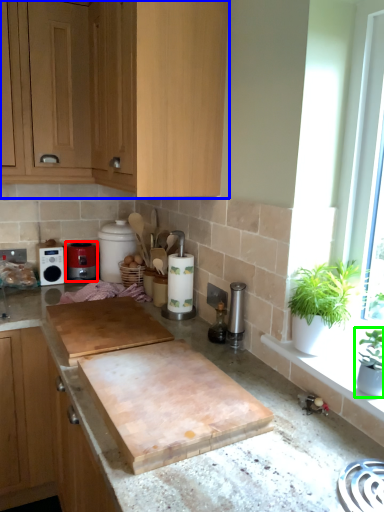
Question: Considering the real-world distances, which object is farthest from kitchen appliance (highlighted by a red box)? cabinetry (highlighted by a blue box) or houseplant (highlighted by a green box)?

Choices:
 (A) cabinetry
 (B) houseplant

Answer: (B)